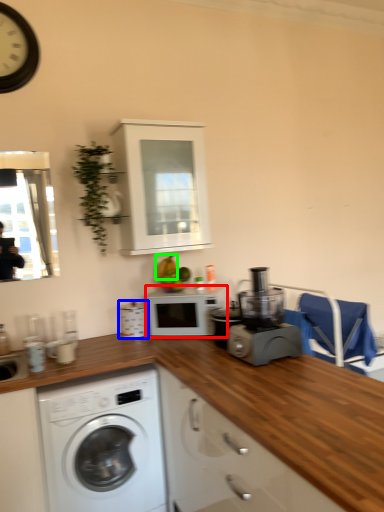
Question: Estimate the real-world distances between objects in this image. Which object is closer to microwave oven (highlighted by a red box), appliance (highlighted by a blue box) or fruit (highlighted by a green box)?

Choices:
 (A) appliance
 (B) fruit

Answer: (A)